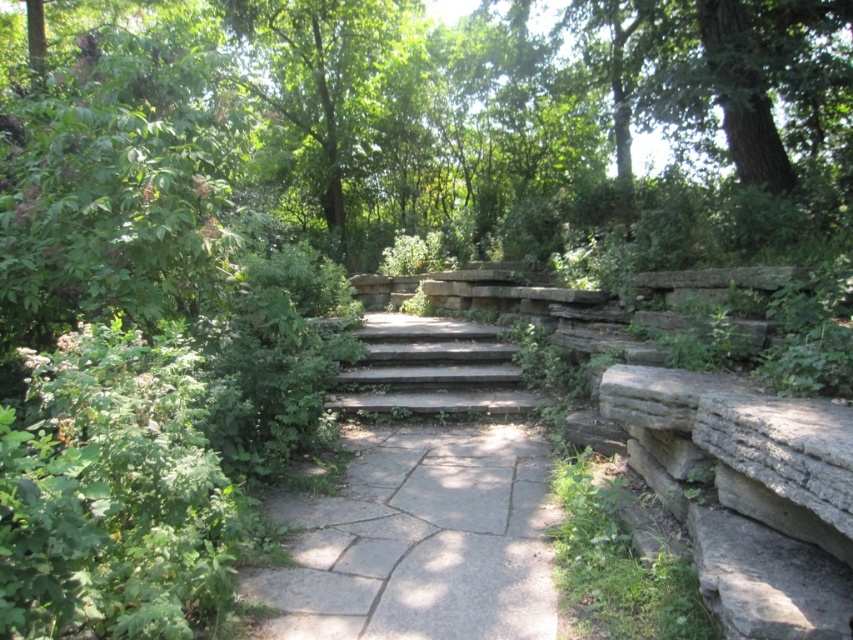
Question: Among these points, which one is farthest from the camera?

Choices:
 (A) (397, 332)
 (B) (334, 6)

Answer: (B)

Question: Observing the image, what is the correct spatial positioning of gray stone path at center in reference to green leafy tree at upper center?

Choices:
 (A) left
 (B) right

Answer: (B)

Question: Which point is closer to the camera taking this photo?

Choices:
 (A) (477, 371)
 (B) (491, 452)
 (C) (376, 44)

Answer: (B)

Question: In this image, where is green leafy tree at upper center located relative to gray stone stairs at center?

Choices:
 (A) left
 (B) right

Answer: (A)

Question: Which object appears closest to the camera in this image?

Choices:
 (A) gray stone stairs at center
 (B) green leafy tree at upper center
 (C) gray stone path at center

Answer: (C)

Question: Does gray stone path at center appear on the left side of green leafy tree at upper center?

Choices:
 (A) yes
 (B) no

Answer: (B)